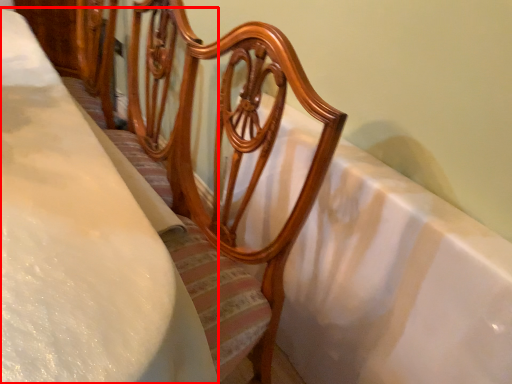
Question: From the image's perspective, what is the correct spatial positioning of sheet (annotated by the red box) in reference to bath?

Choices:
 (A) below
 (B) above

Answer: (B)